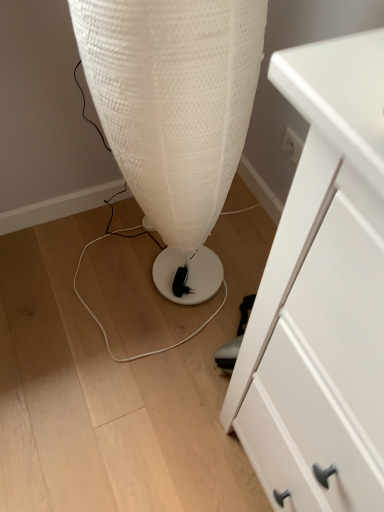
In order to click on vacant area that is in front of white mesh lamp at center in this screenshot , I will do `click(137, 358)`.